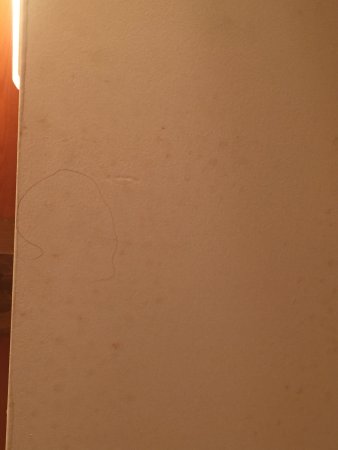
At what (x,y) coordinates should I click in order to perform the action: click on water stain. Please return your answer as a coordinate pair (x, y). The image size is (338, 450). Looking at the image, I should click on (42, 181), (110, 278), (34, 241).